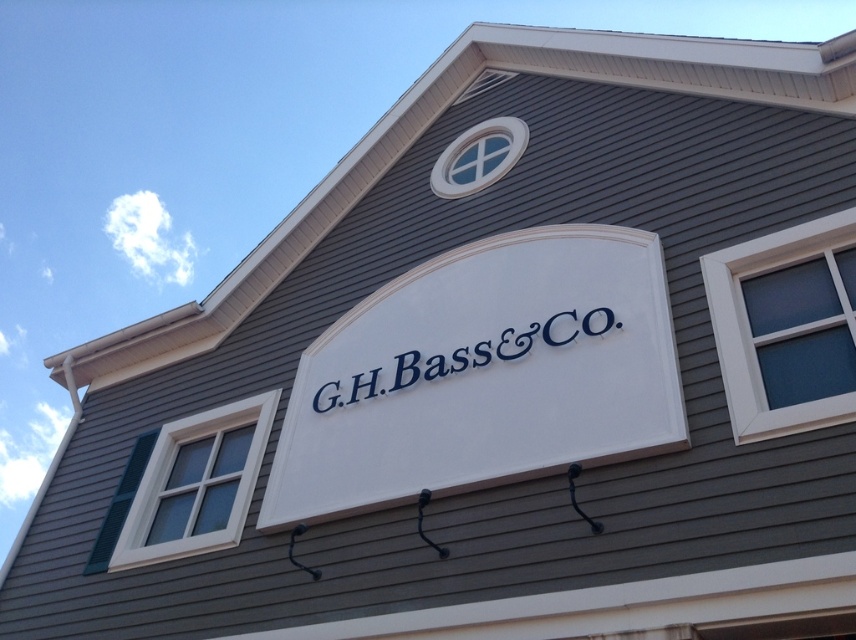
You are a delivery person trying to attach a parcel to the sign. The parcel is 15 inches long. Can you fit the parcel horizontally between the white matte sign at center and the white painted signboard at center without bending it?

The distance between the white matte sign at center and the white painted signboard at center is 16.45 inches. Since the parcel is 15 inches long, it can fit horizontally between them without bending.

You are standing in front of a building with two signs. You see the white matte sign at center and the white painted signboard at center. Which one is positioned to the left?

The white matte sign at center is to the left of the white painted signboard at center.

You are standing in front of the G.H. Bass Co. building and want to reach a specific point marked at coordinates point (544, 308). If your reach extends 2 meters, can you touch that point without moving closer?

The point (544, 308) is 6.47 meters away from the viewer. Since your reach only extends 2 meters, you cannot touch it without moving closer.